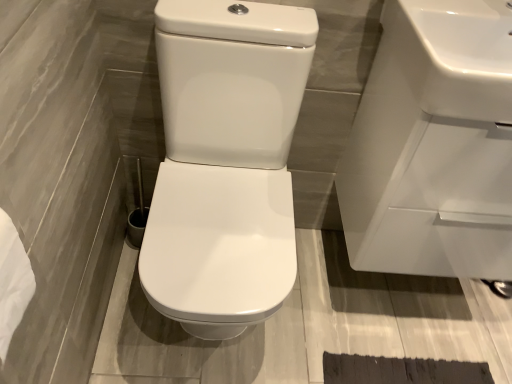
Measure the distance between point [12,315] and camera.

Point [12,315] and camera are 47.00 centimeters apart.

Describe the element at coordinates (225, 162) in the screenshot. I see `white glossy toilet at center` at that location.

What do you see at coordinates (455, 55) in the screenshot?
I see `white glossy sink at upper right, acting as the 2th sink starting from the back` at bounding box center [455, 55].

I want to click on white glossy sink at upper right, arranged as the first sink when viewed from the back, so click(x=434, y=145).

Who is bigger, white glossy sink at upper right, placed as the first sink when sorted from front to back, or white paper towel at lower left?

Bigger between the two is white glossy sink at upper right, placed as the first sink when sorted from front to back.

How many degrees apart are the facing directions of white glossy sink at upper right, acting as the 2th sink starting from the back, and white paper towel at lower left?

89.5 degrees.

Locate an element on the screen. The image size is (512, 384). toilet paper lying below the white glossy sink at upper right, placed as the first sink when sorted from front to back (from the image's perspective) is located at coordinates coord(12,281).

Is white glossy sink at upper right, acting as the 2th sink starting from the back, facing towards white paper towel at lower left?

No, white glossy sink at upper right, acting as the 2th sink starting from the back, does not turn towards white paper towel at lower left.

Does white glossy toilet at center have a lesser height compared to white glossy sink at upper right, arranged as the first sink when viewed from the back?

No, white glossy toilet at center is not shorter than white glossy sink at upper right, arranged as the first sink when viewed from the back.

Which point is more distant from viewer, (241, 296) or (359, 132)?

Positioned behind is point (359, 132).

How many degrees apart are the facing directions of white glossy toilet at center and white glossy sink at upper right, arranged as the first sink when viewed from the back?

The angular difference between white glossy toilet at center and white glossy sink at upper right, arranged as the first sink when viewed from the back, is 0.674 degrees.

Is white glossy toilet at center positioned with its back to white glossy sink at upper right, arranged as the first sink when viewed from the back?

That's not correct — white glossy toilet at center is not looking away from white glossy sink at upper right, arranged as the first sink when viewed from the back.

Considering the relative sizes of white glossy toilet at center and white paper towel at lower left in the image provided, is white glossy toilet at center bigger than white paper towel at lower left?

Indeed, white glossy toilet at center has a larger size compared to white paper towel at lower left.

Does white glossy toilet at center have a lesser height compared to white paper towel at lower left?

No, white glossy toilet at center is not shorter than white paper towel at lower left.

Which is closer to the camera, (x=268, y=127) or (x=22, y=285)?

Positioned in front is point (x=22, y=285).

Locate an element on the screen. Image resolution: width=512 pixels, height=384 pixels. toilet paper that appears in front of the white glossy toilet at center is located at coordinates (12, 281).

Considering their positions, is white glossy sink at upper right, placed as the first sink when sorted from front to back, located in front of or behind white glossy toilet at center?

Clearly, white glossy sink at upper right, placed as the first sink when sorted from front to back, is behind white glossy toilet at center.

Can you tell me how much white glossy sink at upper right, placed as the first sink when sorted from front to back, and white glossy toilet at center differ in facing direction?

0.44 degrees separate the facing orientations of white glossy sink at upper right, placed as the first sink when sorted from front to back, and white glossy toilet at center.

Is white glossy sink at upper right, placed as the first sink when sorted from front to back, spatially inside white glossy toilet at center, or outside of it?

white glossy sink at upper right, placed as the first sink when sorted from front to back, is outside white glossy toilet at center.

From a real-world perspective, between white glossy sink at upper right, placed as the first sink when sorted from front to back, and white glossy toilet at center, who is vertically higher?

white glossy sink at upper right, placed as the first sink when sorted from front to back, is physically above.

Based on the photo, from a real-world perspective, which is physically below, white paper towel at lower left or white glossy toilet at center?

white glossy toilet at center is physically lower.

Does point (19, 322) come behind point (200, 217)?

No, it is in front of (200, 217).

Is white glossy toilet at center inside white paper towel at lower left?

No, white glossy toilet at center is located outside of white paper towel at lower left.

Visually, is white paper towel at lower left positioned to the left or to the right of white glossy toilet at center?

In the image, white paper towel at lower left appears on the left side of white glossy toilet at center.

Is white glossy sink at upper right, placed as the first sink when sorted from front to back, at the back of white glossy toilet at center?

white glossy toilet at center is not turned away from white glossy sink at upper right, placed as the first sink when sorted from front to back.

This screenshot has height=384, width=512. In the image, there is a white glossy sink at upper right, acting as the 2th sink starting from the back. In order to click on toilet below it (from a real-world perspective) in this screenshot , I will do `click(225, 162)`.

Is white glossy toilet at center bigger than white glossy sink at upper right, acting as the 2th sink starting from the back?

Indeed, white glossy toilet at center has a larger size compared to white glossy sink at upper right, acting as the 2th sink starting from the back.

Is white glossy toilet at center not close to white glossy sink at upper right, acting as the 2th sink starting from the back?

No, there isn't a large distance between white glossy toilet at center and white glossy sink at upper right, acting as the 2th sink starting from the back.

Which object is positioned more to the left, white paper towel at lower left or white glossy sink at upper right, placed as the first sink when sorted from front to back?

From the viewer's perspective, white paper towel at lower left appears more on the left side.

Is white paper towel at lower left facing away from white glossy sink at upper right, acting as the 2th sink starting from the back?

No, white paper towel at lower left's orientation is not away from white glossy sink at upper right, acting as the 2th sink starting from the back.

How far apart are white paper towel at lower left and white glossy sink at upper right, acting as the 2th sink starting from the back?

white paper towel at lower left and white glossy sink at upper right, acting as the 2th sink starting from the back, are 32.32 inches apart.

Which is less distant, (26, 289) or (477, 116)?

The point (26, 289) is in front.

This screenshot has height=384, width=512. What are the coordinates of `toilet paper in front of the white glossy sink at upper right, placed as the first sink when sorted from front to back` in the screenshot? It's located at (12, 281).

Where is `toilet below the white glossy sink at upper right, positioned as the second sink in front-to-back order (from the image's perspective)`? The image size is (512, 384). toilet below the white glossy sink at upper right, positioned as the second sink in front-to-back order (from the image's perspective) is located at coordinates (225, 162).

From the image, which object appears to be nearer to white paper towel at lower left, white glossy sink at upper right, placed as the first sink when sorted from front to back, or white glossy toilet at center?

Among the two, white glossy toilet at center is located nearer to white paper towel at lower left.

Based on their spatial positions, is white glossy sink at upper right, acting as the 2th sink starting from the back, or white glossy sink at upper right, arranged as the first sink when viewed from the back, further from white glossy toilet at center?

white glossy sink at upper right, acting as the 2th sink starting from the back.

Estimate the real-world distances between objects in this image. Which object is further from white glossy toilet at center, white paper towel at lower left or white glossy sink at upper right, arranged as the first sink when viewed from the back?

The object further to white glossy toilet at center is white paper towel at lower left.

Looking at this image, considering their positions, is white paper towel at lower left positioned further to white glossy sink at upper right, positioned as the second sink in front-to-back order, than white glossy toilet at center?

white paper towel at lower left.

From the image, which object appears to be farther from white paper towel at lower left, white glossy toilet at center or white glossy sink at upper right, positioned as the second sink in front-to-back order?

white glossy sink at upper right, positioned as the second sink in front-to-back order, is further to white paper towel at lower left.

Estimate the real-world distances between objects in this image. Which object is closer to white paper towel at lower left, white glossy sink at upper right, positioned as the second sink in front-to-back order, or white glossy toilet at center?

Based on the image, white glossy toilet at center appears to be nearer to white paper towel at lower left.

When comparing their distances from white paper towel at lower left, does white glossy sink at upper right, placed as the first sink when sorted from front to back, or white glossy sink at upper right, positioned as the second sink in front-to-back order, seem further?

The object further to white paper towel at lower left is white glossy sink at upper right, positioned as the second sink in front-to-back order.

When comparing their distances from white glossy toilet at center, does white glossy sink at upper right, arranged as the first sink when viewed from the back, or white glossy sink at upper right, placed as the first sink when sorted from front to back, seem further?

white glossy sink at upper right, placed as the first sink when sorted from front to back.

This screenshot has height=384, width=512. I want to click on toilet between white paper towel at lower left and white glossy sink at upper right, positioned as the second sink in front-to-back order, in the horizontal direction, so [x=225, y=162].

At what (x,y) coordinates should I click in order to perform the action: click on sink located between white glossy toilet at center and white glossy sink at upper right, arranged as the first sink when viewed from the back, in the left-right direction. Please return your answer as a coordinate pair (x, y). The image size is (512, 384). Looking at the image, I should click on (455, 55).

This screenshot has height=384, width=512. I want to click on sink situated between white paper towel at lower left and white glossy sink at upper right, positioned as the second sink in front-to-back order, from left to right, so click(455, 55).

Where is `toilet between white paper towel at lower left and white glossy sink at upper right, placed as the first sink when sorted from front to back`? This screenshot has height=384, width=512. toilet between white paper towel at lower left and white glossy sink at upper right, placed as the first sink when sorted from front to back is located at coordinates (225, 162).